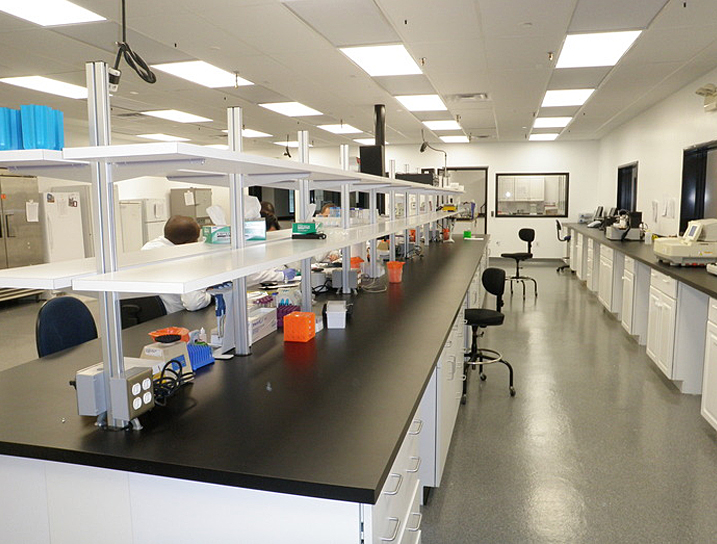
This screenshot has height=544, width=717. I want to click on shelving, so click(180, 270).